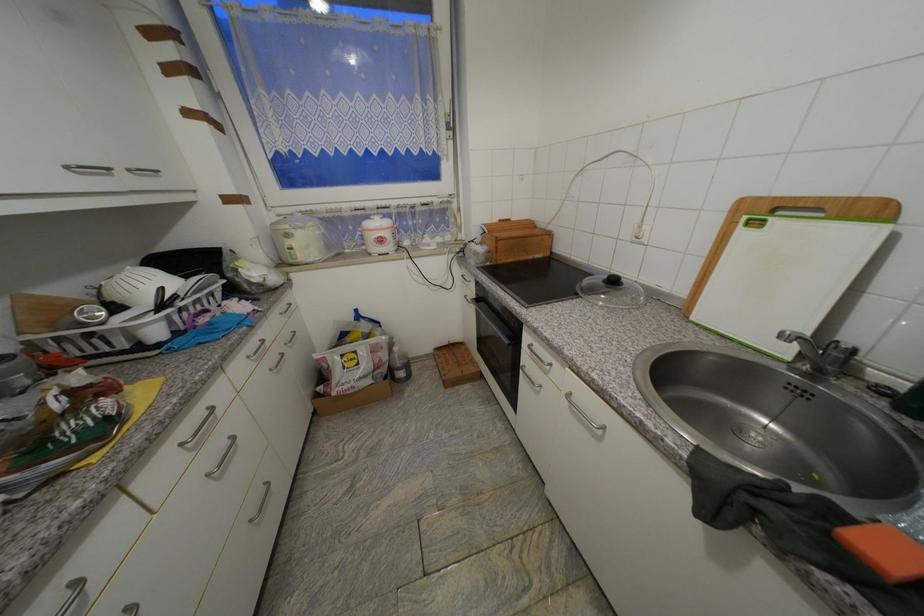
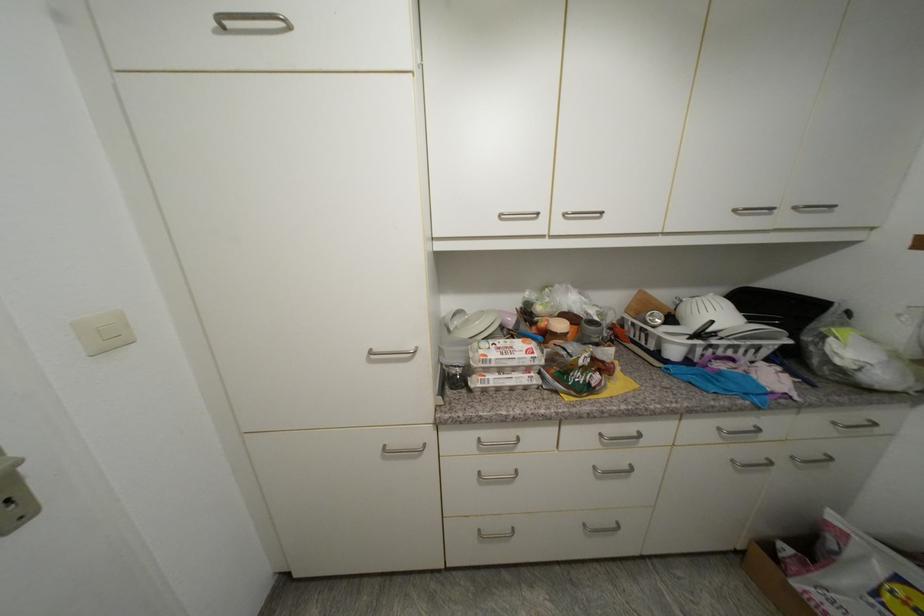
The images are taken continuously from a first-person perspective. In which direction is your viewpoint rotating?

The camera's rotation is toward left-down.